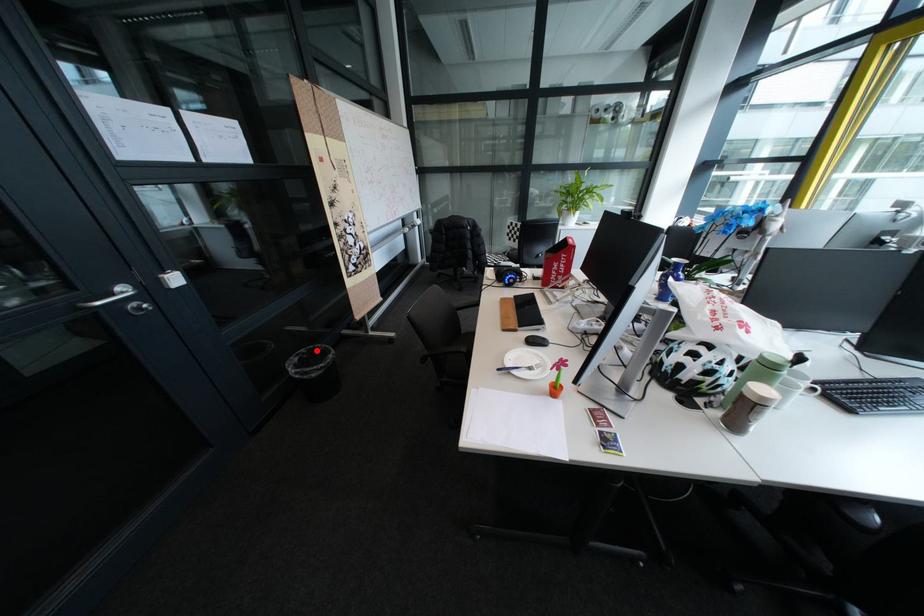
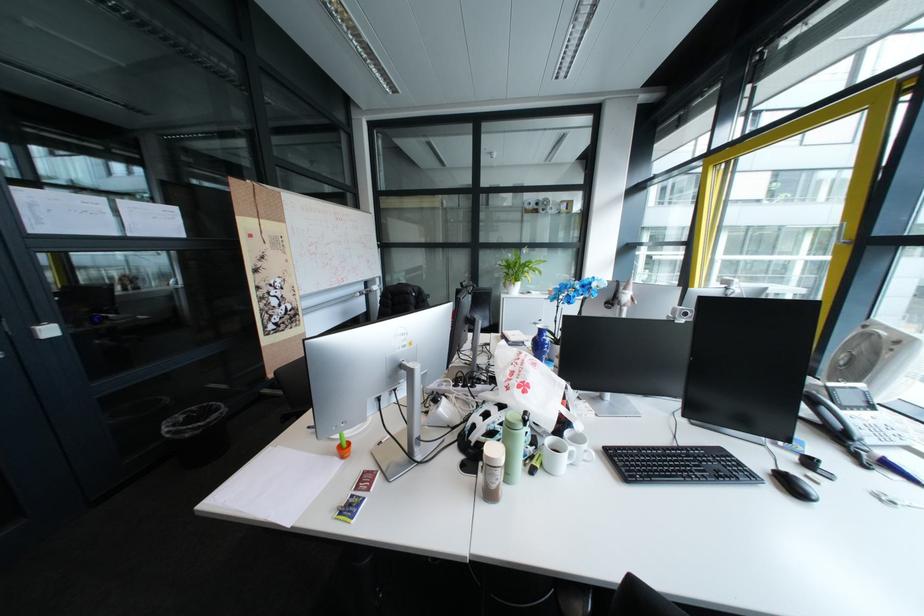
Find the pixel in the second image that matches the highlighted location in the first image.

(208, 408)